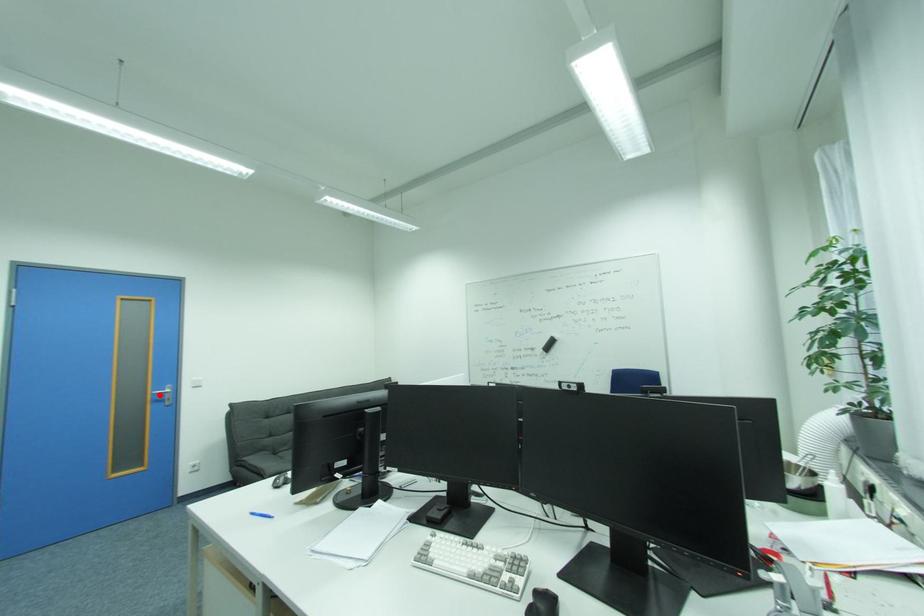
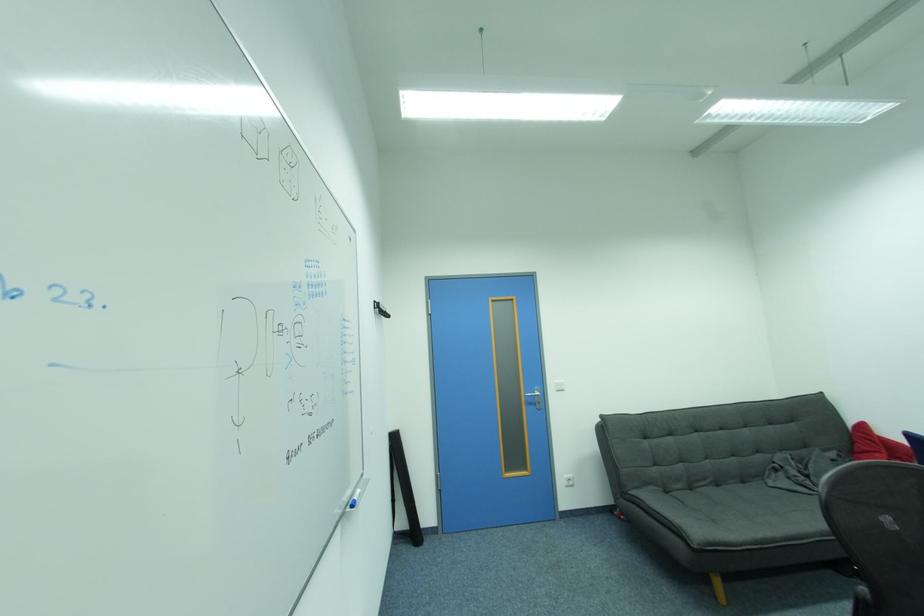
In the second image, find the point that corresponds to the highlighted location in the first image.

(532, 397)